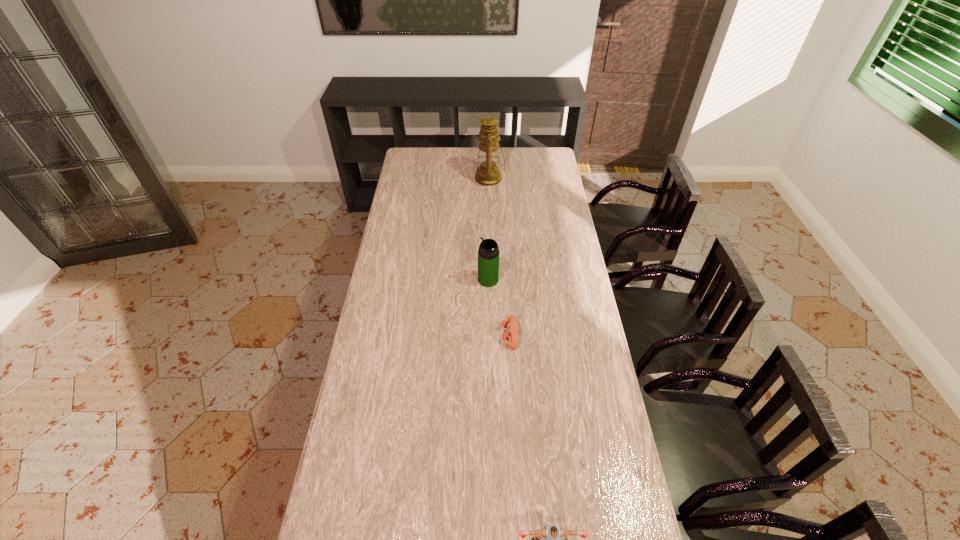
Locate an element on the screen. The width and height of the screenshot is (960, 540). vacant space in between the shorter puncher and the thermos bottle is located at coordinates coord(499,307).

Locate an element on the screen. This screenshot has width=960, height=540. free space between the thermos bottle and the farther puncher is located at coordinates (499, 307).

This screenshot has width=960, height=540. I want to click on free space between the thermos bottle and the tallest object, so click(489, 229).

Identify which object is located as the nearest to the nearer puncher. Please provide its 2D coordinates. Your answer should be formatted as a tuple, i.e. [(x, y)], where the tuple contains the x and y coordinates of a point satisfying the conditions above.

[(512, 327)]

Locate an element on the screen. object that is the second closest to the nearest object is located at coordinates (488, 253).